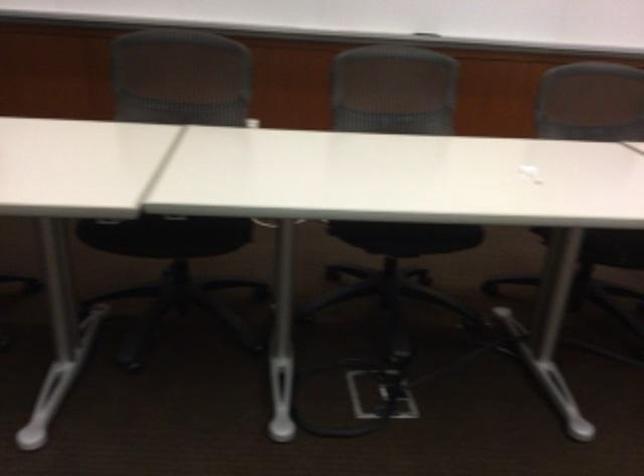
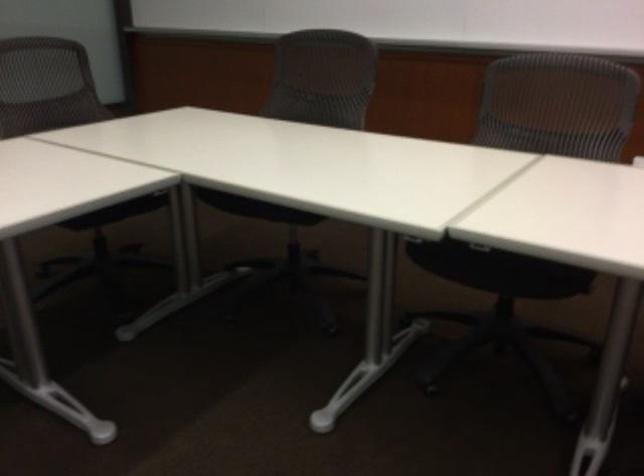
Question: The images are taken continuously from a first-person perspective. In which direction is your viewpoint rotating?

Choices:
 (A) Left
 (B) Right
 (C) Up
 (D) Down

Answer: (A)